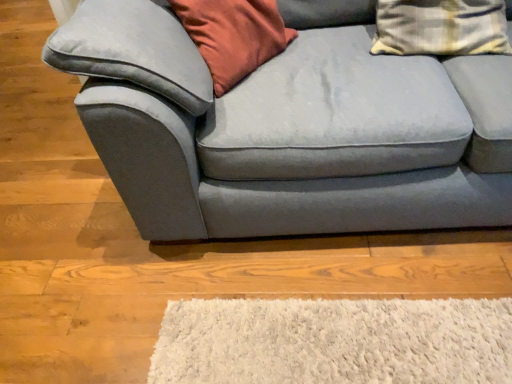
The image size is (512, 384). I want to click on suede gray couch at center, so click(x=289, y=128).

Image resolution: width=512 pixels, height=384 pixels. Describe the element at coordinates (289, 128) in the screenshot. I see `suede gray couch at center` at that location.

What do you see at coordinates (440, 27) in the screenshot? The width and height of the screenshot is (512, 384). I see `plaid fabric pillow at upper right` at bounding box center [440, 27].

Identify the location of plaid fabric pillow at upper right. (440, 27).

Find the location of a particular element. Image resolution: width=512 pixels, height=384 pixels. suede gray couch at center is located at coordinates (289, 128).

Based on their positions, is plaid fabric pillow at upper right located to the left or right of suede gray couch at center?

plaid fabric pillow at upper right is to the right of suede gray couch at center.

Is plaid fabric pillow at upper right in front of or behind suede gray couch at center in the image?

plaid fabric pillow at upper right is positioned farther from the viewer than suede gray couch at center.

Which is farther, (462, 34) or (253, 90)?

Positioned behind is point (462, 34).

From the image's perspective, is plaid fabric pillow at upper right above suede gray couch at center?

Yes, from the image's perspective, plaid fabric pillow at upper right is over suede gray couch at center.

From a real-world perspective, which object rests below the other?

suede gray couch at center, from a real-world perspective.

In terms of width, does plaid fabric pillow at upper right look wider or thinner when compared to suede gray couch at center?

Considering their sizes, plaid fabric pillow at upper right looks slimmer than suede gray couch at center.

Is plaid fabric pillow at upper right taller or shorter than suede gray couch at center?

Clearly, plaid fabric pillow at upper right is shorter compared to suede gray couch at center.

Who is smaller, plaid fabric pillow at upper right or suede gray couch at center?

plaid fabric pillow at upper right is smaller.

Do you think plaid fabric pillow at upper right is within suede gray couch at center, or outside of it?

plaid fabric pillow at upper right is spatially positioned inside suede gray couch at center.

In the scene shown: Are plaid fabric pillow at upper right and suede gray couch at center far apart?

No, plaid fabric pillow at upper right is not far from suede gray couch at center.

Is plaid fabric pillow at upper right oriented away from suede gray couch at center?

Absolutely, plaid fabric pillow at upper right is directed away from suede gray couch at center.

How different are the orientations of plaid fabric pillow at upper right and suede gray couch at center in degrees?

The angle between the facing direction of plaid fabric pillow at upper right and the facing direction of suede gray couch at center is 4.33 degrees.

Where is `pillow above the suede gray couch at center (from the image's perspective)`? This screenshot has height=384, width=512. pillow above the suede gray couch at center (from the image's perspective) is located at coordinates (440, 27).

Is suede gray couch at center at the right side of plaid fabric pillow at upper right?

In fact, suede gray couch at center is to the left of plaid fabric pillow at upper right.

Considering the positions of objects suede gray couch at center and plaid fabric pillow at upper right in the image provided, who is behind, suede gray couch at center or plaid fabric pillow at upper right?

plaid fabric pillow at upper right is more distant.

Considering the points (488, 74) and (472, 14), which point is behind, point (488, 74) or point (472, 14)?

Positioned behind is point (472, 14).

From the image's perspective, is suede gray couch at center positioned above or below plaid fabric pillow at upper right?

From the image's perspective, suede gray couch at center appears below plaid fabric pillow at upper right.

From a real-world perspective, which is physically above, suede gray couch at center or plaid fabric pillow at upper right?

plaid fabric pillow at upper right, from a real-world perspective.

Which of these two, suede gray couch at center or plaid fabric pillow at upper right, is thinner?

Thinner between the two is plaid fabric pillow at upper right.

Considering the sizes of objects suede gray couch at center and plaid fabric pillow at upper right in the image provided, who is shorter, suede gray couch at center or plaid fabric pillow at upper right?

Standing shorter between the two is plaid fabric pillow at upper right.

Can you confirm if suede gray couch at center is bigger than plaid fabric pillow at upper right?

Indeed, suede gray couch at center has a larger size compared to plaid fabric pillow at upper right.

Is suede gray couch at center not inside plaid fabric pillow at upper right?

Yes, suede gray couch at center is located beyond the bounds of plaid fabric pillow at upper right.

Is the surface of suede gray couch at center in direct contact with plaid fabric pillow at upper right?

No, suede gray couch at center is not with plaid fabric pillow at upper right.

Is suede gray couch at center looking in the opposite direction of plaid fabric pillow at upper right?

Yes.

I want to click on studio couch below the plaid fabric pillow at upper right (from a real-world perspective), so click(289, 128).

Locate an element on the screen. pillow on the right of suede gray couch at center is located at coordinates (440, 27).

Find the location of a particular element. studio couch located on the left of plaid fabric pillow at upper right is located at coordinates (289, 128).